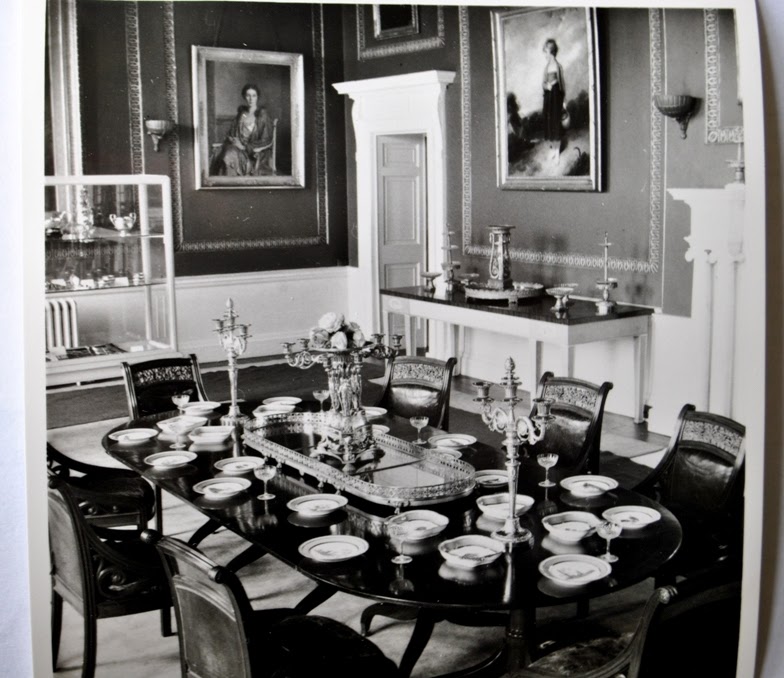
This screenshot has height=678, width=784. I want to click on window frame, so click(x=73, y=134).